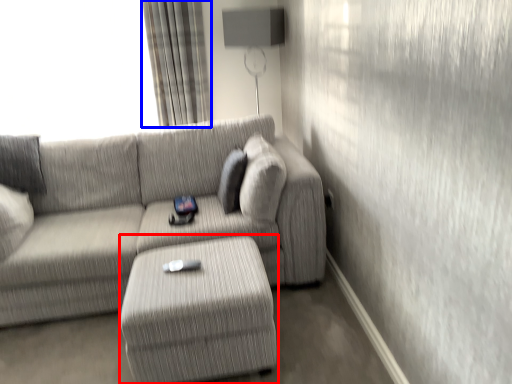
Question: Which point is further to the camera, table (highlighted by a red box) or curtain (highlighted by a blue box)?

Choices:
 (A) table
 (B) curtain

Answer: (B)